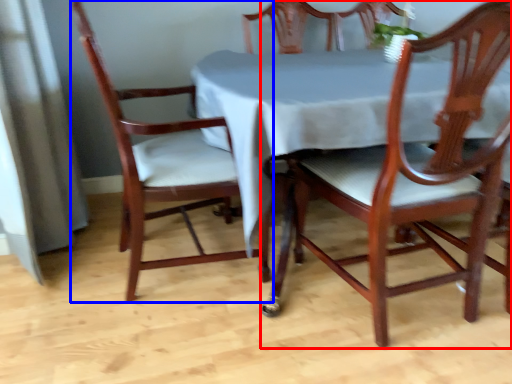
Question: Which of the following is the farthest to the observer, chair (highlighted by a red box) or chair (highlighted by a blue box)?

Choices:
 (A) chair
 (B) chair

Answer: (B)